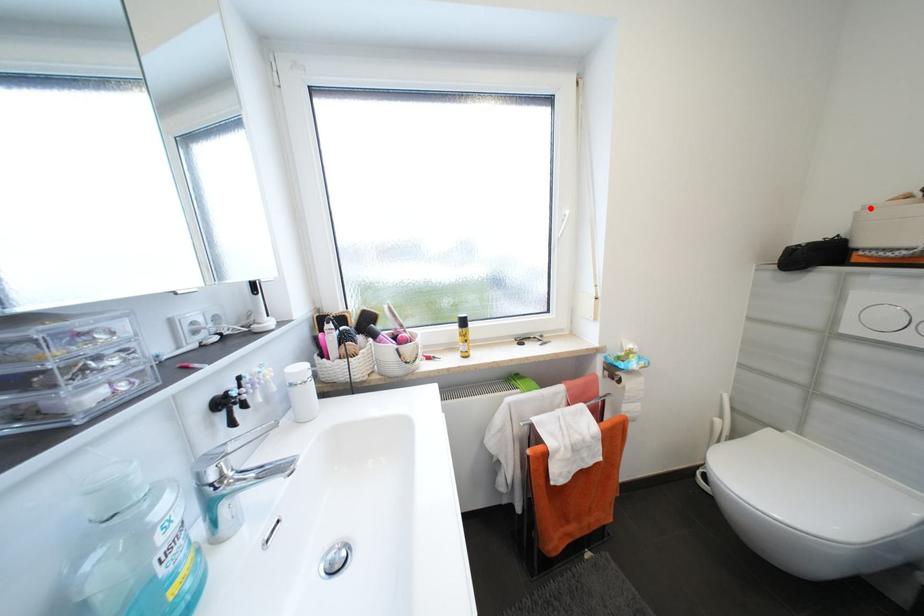
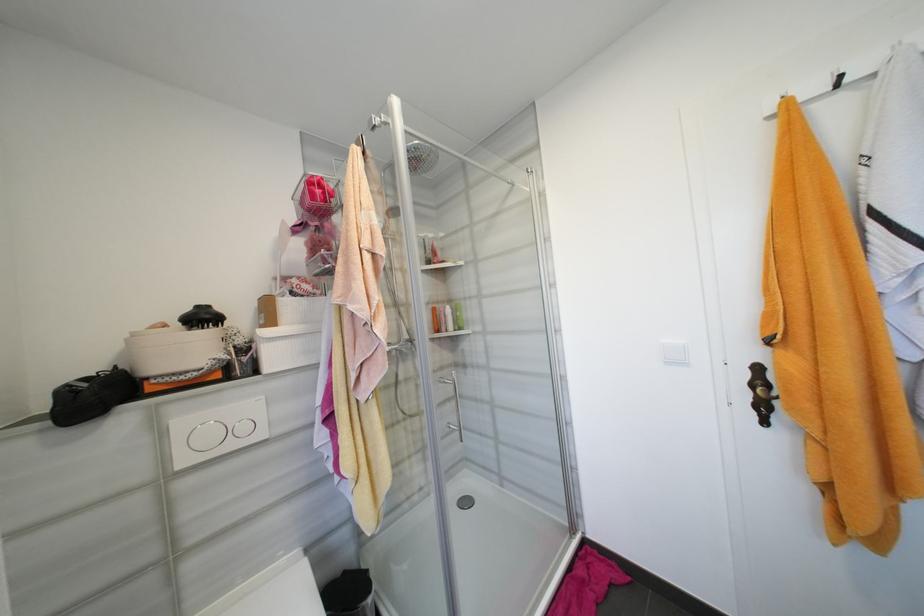
Find the pixel in the second image that matches the highlighted location in the first image.

(140, 334)